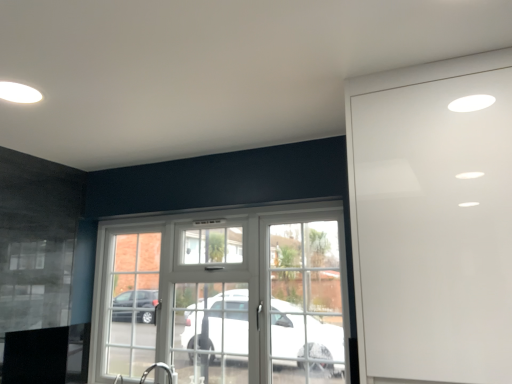
Question: Considering the relative sizes of white glass door at center and white glossy cabinet at right in the image provided, is white glass door at center smaller than white glossy cabinet at right?

Choices:
 (A) yes
 (B) no

Answer: (A)

Question: From a real-world perspective, is white glass door at center on white glossy cabinet at right?

Choices:
 (A) no
 (B) yes

Answer: (A)

Question: Can you confirm if white glass door at center is taller than white glossy cabinet at right?

Choices:
 (A) no
 (B) yes

Answer: (A)

Question: Does white glass door at center have a lesser height compared to white glossy cabinet at right?

Choices:
 (A) yes
 (B) no

Answer: (A)

Question: Is white glass door at center bigger than white glossy cabinet at right?

Choices:
 (A) yes
 (B) no

Answer: (B)

Question: Considering the relative positions of white glass door at center and white glossy cabinet at right in the image provided, is white glass door at center in front of white glossy cabinet at right?

Choices:
 (A) yes
 (B) no

Answer: (B)

Question: Is white glossy cabinet at right far from white glass door at center?

Choices:
 (A) no
 (B) yes

Answer: (B)

Question: Is white glossy cabinet at right taller than white glass door at center?

Choices:
 (A) yes
 (B) no

Answer: (A)

Question: Is white glossy cabinet at right at the left side of white glass door at center?

Choices:
 (A) yes
 (B) no

Answer: (B)

Question: From a real-world perspective, is white glossy cabinet at right on top of white glass door at center?

Choices:
 (A) yes
 (B) no

Answer: (A)

Question: Can you confirm if white glossy cabinet at right is bigger than white glass door at center?

Choices:
 (A) no
 (B) yes

Answer: (B)

Question: Is white glossy cabinet at right not within white glass door at center?

Choices:
 (A) yes
 (B) no

Answer: (A)

Question: Does point (150, 218) appear closer or farther from the camera than point (492, 307)?

Choices:
 (A) closer
 (B) farther

Answer: (B)